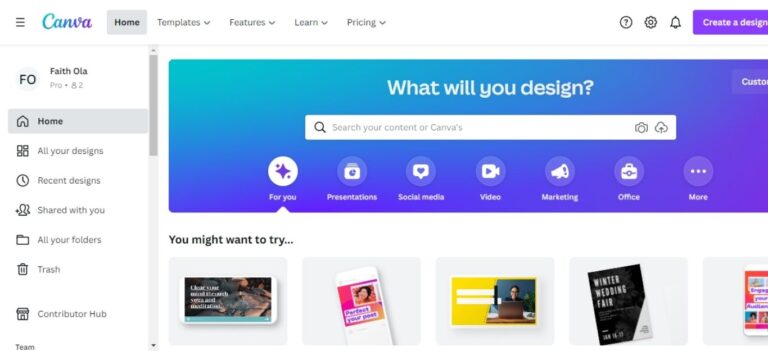
Find the location of a particular element. The height and width of the screenshot is (351, 768). menu areas is located at coordinates (51, 121), (65, 149), (58, 181), (55, 212), (50, 242), (48, 272).